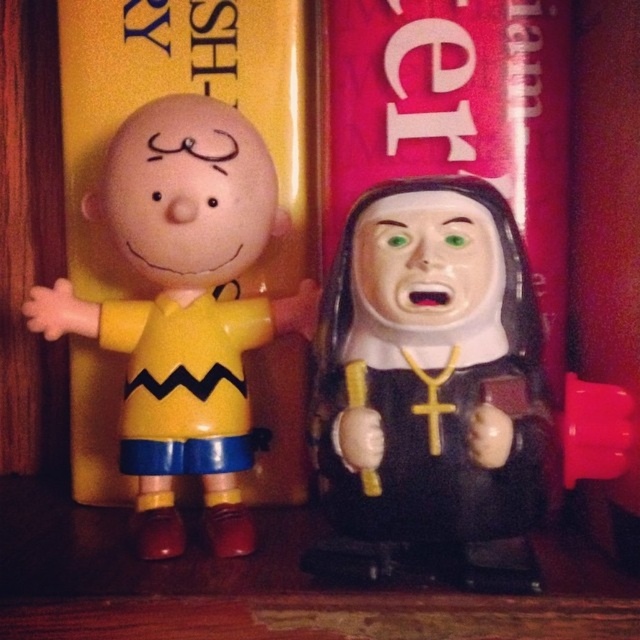
Looking at this image, you are organizing a display and need to place both the black matte nun at center and the yellow matte plastic charlie brown figure at left into a narrow shelf space. Based on their widths, which figurine should be placed first to ensure both fit?

The black matte nun at center is thinner than the yellow matte plastic charlie brown figure at left, so place the black matte nun at center first to accommodate the wider figure next.

You have a rectangular shelf that is 20 centimeters wide. You want to place both the black matte nun at center and the yellow matte plastic charlie brown figure at left on it. Can both figurines fit side by side without overlapping?

The black matte nun at center is 16.59 centimeters away from the yellow matte plastic charlie brown figure at left. Since the shelf is 20 centimeters wide, which is wider than the combined width of both figurines plus the space between them, they can fit side by side without overlapping.

Based on the photo, you are organizing a display and need to place the black matte nun at center and the yellow matte plastic charlie brown figure at left on a shelf. If the shelf has limited space, which figurine should you remove to free up more space?

The black matte nun at center occupies less space than the yellow matte plastic charlie brown figure at left, so removing the black matte nun at center would free up less space. Therefore, to free up more space, you should remove the yellow matte plastic charlie brown figure at left.